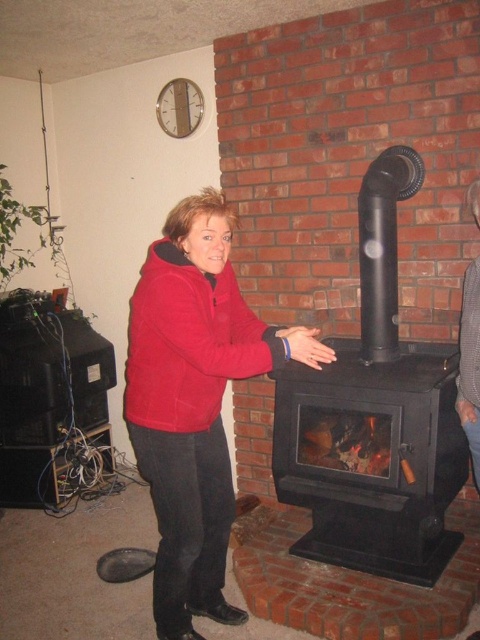
Does black matte fireplace at center have a smaller size compared to red fleece jacket at center?

No, black matte fireplace at center is not smaller than red fleece jacket at center.

Between black matte fireplace at center and red fleece jacket at center, which one is positioned higher?

Positioned higher is black matte fireplace at center.

Who is more distant from viewer, [370,540] or [168,276]?

The point [370,540] is behind.

Find the location of a particular element. black matte fireplace at center is located at coordinates (374, 419).